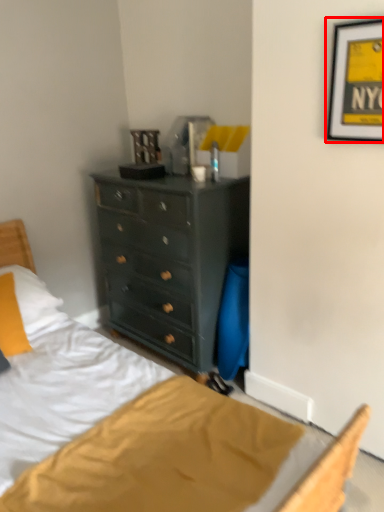
Question: From the image's perspective, considering the relative positions of picture frame (annotated by the red box) and pillow in the image provided, where is picture frame (annotated by the red box) located with respect to the staircase?

Choices:
 (A) below
 (B) above

Answer: (B)